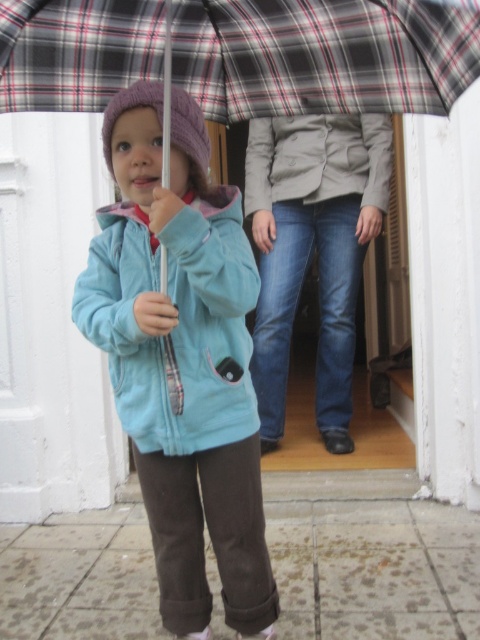
Which is below, matte blue jacket at center or light blue fleece jacket at center?

matte blue jacket at center is below.

Consider the image. Who is more forward, (243, 323) or (83, 330)?

Point (83, 330) is more forward.

Which is in front, point (143, 259) or point (134, 401)?

Positioned in front is point (143, 259).

Where is `matte blue jacket at center`? matte blue jacket at center is located at coordinates (181, 358).

In the scene shown: Which of these two, matte blue jacket at center or light gray textured jacket at center, stands taller?

Standing taller between the two is matte blue jacket at center.

Is point (173, 540) less distant than point (347, 177)?

Yes, point (173, 540) is in front of point (347, 177).

Image resolution: width=480 pixels, height=640 pixels. What are the coordinates of `matte blue jacket at center` in the screenshot? It's located at (181, 358).

Where is `matte blue jacket at center`? Image resolution: width=480 pixels, height=640 pixels. matte blue jacket at center is located at coordinates (181, 358).

Which of these two, plaid fabric umbrella at upper center or blue denim jeans at center, stands taller?

blue denim jeans at center is taller.

Is point (418, 28) in front of point (273, 211)?

Yes, it is.

Where is `plaid fabric umbrella at upper center`? This screenshot has width=480, height=640. plaid fabric umbrella at upper center is located at coordinates (324, 54).